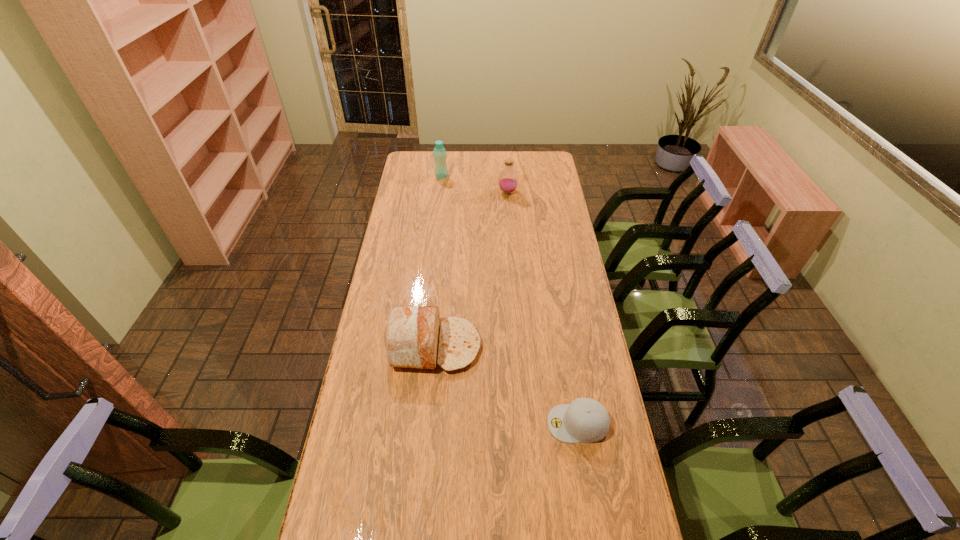
Identify the location of the left bottle. Image resolution: width=960 pixels, height=540 pixels. (439, 152).

Identify the location of the farthest object. This screenshot has width=960, height=540. (439, 152).

Locate an element on the screen. the second object from right to left is located at coordinates (508, 180).

I want to click on the second farthest object, so click(x=508, y=180).

This screenshot has width=960, height=540. I want to click on bread, so click(x=411, y=336).

The width and height of the screenshot is (960, 540). What are the coordinates of `the third farthest object` in the screenshot? It's located at (411, 336).

Find the location of a particular element. the rightmost object is located at coordinates (585, 420).

The image size is (960, 540). Find the location of `the nearest object`. the nearest object is located at coordinates (585, 420).

Locate an element on the screen. This screenshot has width=960, height=540. vacant area situated on the left of the farther bottle is located at coordinates (414, 176).

Identify the location of free space located on the right of the nearer bottle. (552, 192).